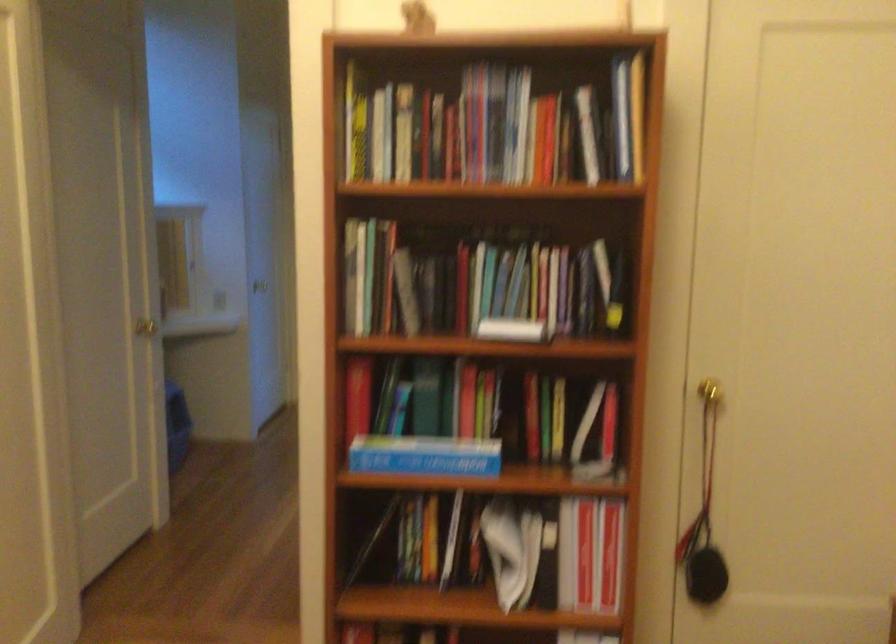
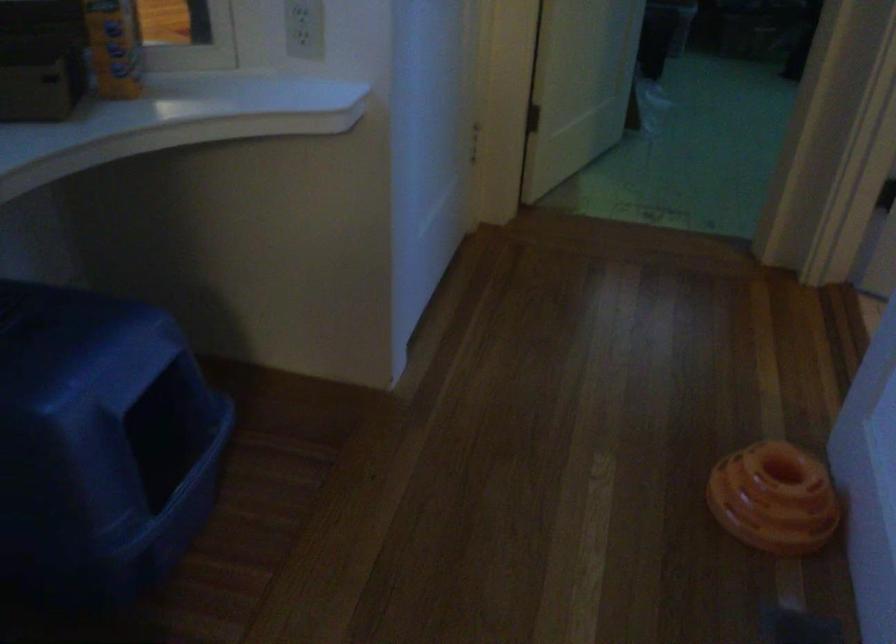
Question: What movement of the cameraman would produce the second image?

Choices:
 (A) Left
 (B) Right
 (C) Forward
 (D) Backward

Answer: (C)